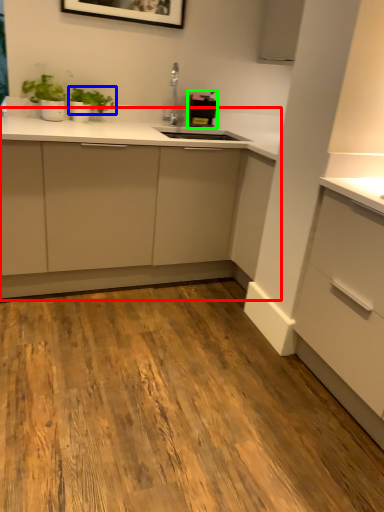
Question: Which is farther away from cabinetry (highlighted by a red box)? plant (highlighted by a blue box) or appliance (highlighted by a green box)?

Choices:
 (A) plant
 (B) appliance

Answer: (A)